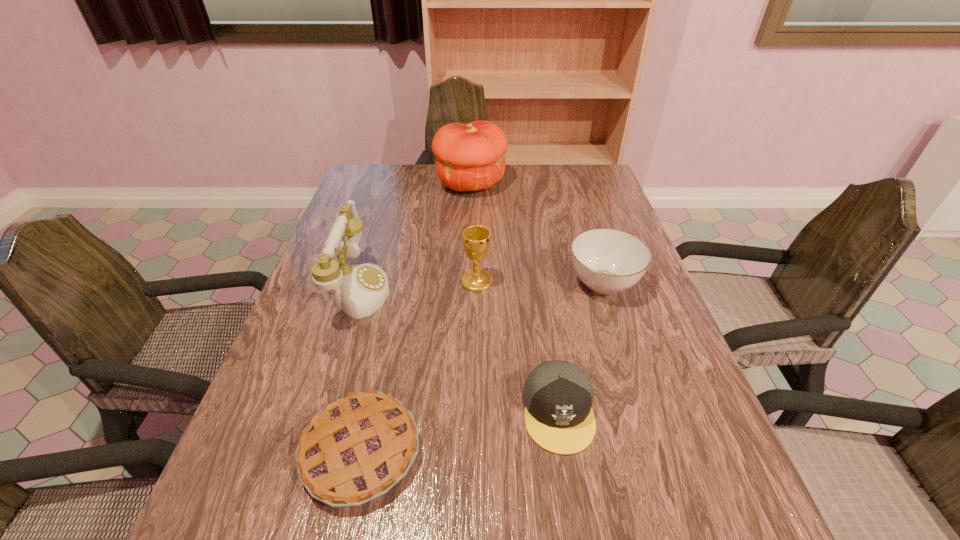
The height and width of the screenshot is (540, 960). In order to click on the farthest object in this screenshot , I will do `click(469, 157)`.

Where is `telephone`? The width and height of the screenshot is (960, 540). telephone is located at coordinates (360, 290).

What are the coordinates of `the fourth shortest object` in the screenshot? It's located at (476, 239).

Locate an element on the screen. This screenshot has width=960, height=540. chinaware is located at coordinates (608, 261).

I want to click on the third shortest object, so click(608, 261).

I want to click on the fifth tallest object, so click(x=558, y=395).

The height and width of the screenshot is (540, 960). What are the coordinates of `pie` in the screenshot? It's located at (356, 449).

Locate an element on the screen. free location located on the right of the farthest object is located at coordinates (545, 184).

I want to click on free location located 0.070m on the dial of the telephone, so click(420, 288).

Locate an element on the screen. vacant region located on the front of the chalice is located at coordinates (476, 416).